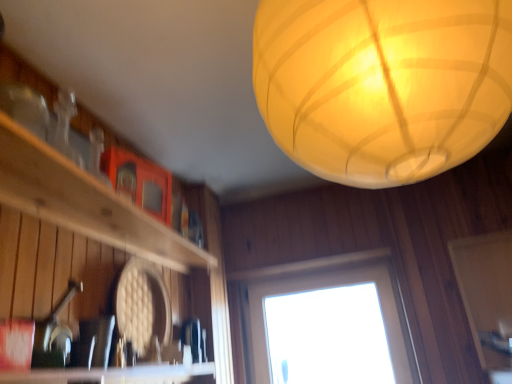
Question: Is translucent paper lantern at upper center facing away from transparent glass window at center?

Choices:
 (A) no
 (B) yes

Answer: (B)

Question: Are translucent paper lantern at upper center and transparent glass window at center far apart?

Choices:
 (A) yes
 (B) no

Answer: (A)

Question: Is translucent paper lantern at upper center further to the viewer compared to transparent glass window at center?

Choices:
 (A) yes
 (B) no

Answer: (B)

Question: From the image's perspective, is translucent paper lantern at upper center beneath transparent glass window at center?

Choices:
 (A) yes
 (B) no

Answer: (B)

Question: Does translucent paper lantern at upper center have a lesser width compared to transparent glass window at center?

Choices:
 (A) yes
 (B) no

Answer: (B)

Question: Looking at their shapes, would you say translucent paper lantern at upper center is wider or thinner than wooden shelf at left?

Choices:
 (A) thin
 (B) wide

Answer: (B)

Question: From a real-world perspective, is translucent paper lantern at upper center above or below wooden shelf at left?

Choices:
 (A) above
 (B) below

Answer: (A)

Question: From the image's perspective, is translucent paper lantern at upper center above or below wooden shelf at left?

Choices:
 (A) below
 (B) above

Answer: (B)

Question: Considering the positions of point (336, 120) and point (145, 223), is point (336, 120) closer or farther from the camera than point (145, 223)?

Choices:
 (A) farther
 (B) closer

Answer: (B)

Question: Is transparent glass window at center spatially inside white matte screen door at lower right, or outside of it?

Choices:
 (A) inside
 (B) outside

Answer: (B)

Question: From a real-world perspective, is transparent glass window at center positioned above or below white matte screen door at lower right?

Choices:
 (A) above
 (B) below

Answer: (B)

Question: Is point (259, 382) closer or farther from the camera than point (462, 284)?

Choices:
 (A) farther
 (B) closer

Answer: (A)

Question: Considering their positions, is transparent glass window at center located in front of or behind white matte screen door at lower right?

Choices:
 (A) behind
 (B) front

Answer: (A)

Question: Considering the positions of translucent paper lantern at upper center and white matte screen door at lower right in the image, is translucent paper lantern at upper center taller or shorter than white matte screen door at lower right?

Choices:
 (A) tall
 (B) short

Answer: (A)

Question: In the image, is translucent paper lantern at upper center positioned in front of or behind white matte screen door at lower right?

Choices:
 (A) front
 (B) behind

Answer: (A)